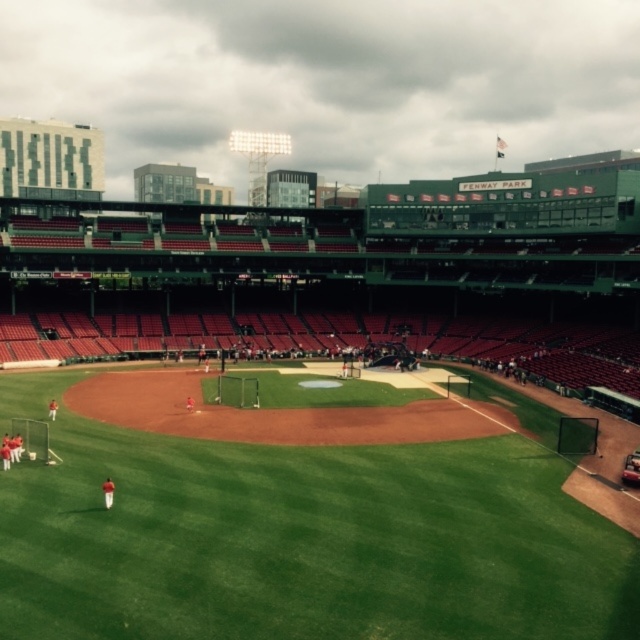
You are a photographer at Fenway Park and want to capture a wide shot of the green grass field at center and the orange uniformed players at lower left. Which object would appear larger in the photo?

The green grass field at center would appear larger in the photo because it is bigger than the orange uniformed players at lower left.

You are a photographer standing at the edge of the green grass field at center and want to capture a photo of the orange uniformed players at lower left. Considering their relative heights, will the players be fully visible in the photo if you aim your camera straight ahead?

The green grass field at center is taller than the orange uniformed players at lower left, so aiming the camera straight ahead might block the players partially or entirely. To ensure full visibility, you should adjust the angle to look downward towards the lower left area.

You are standing at the center of Fenway Park and want to locate the green grass field at center. Which direction should you face to see it?

You are already facing the green grass field at center since you are standing at its center point according to the coordinates provided.